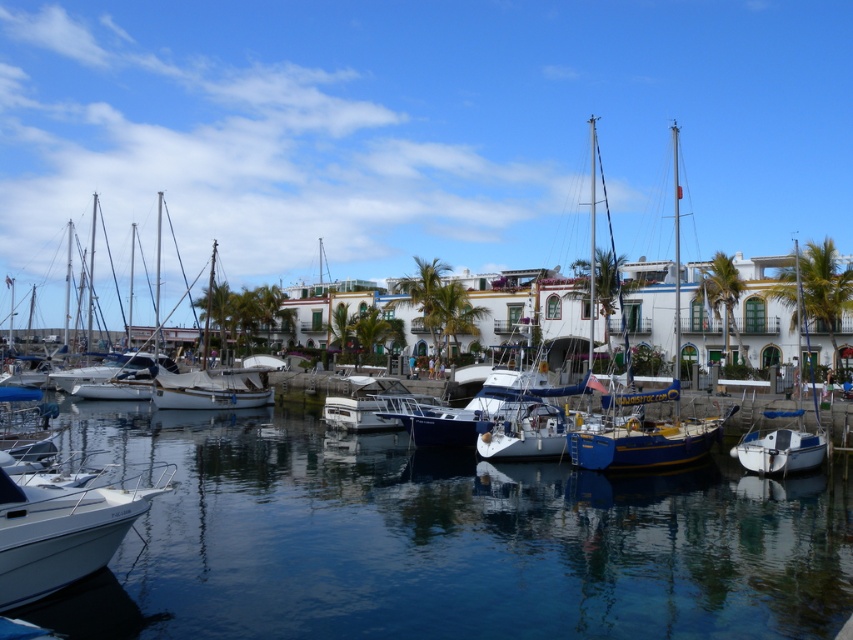
Which of these two, blue glossy sailboat at center or white matte sailboat at center, stands taller?

blue glossy sailboat at center

Can you confirm if blue glossy sailboat at center is bigger than white matte sailboat at center?

Indeed, blue glossy sailboat at center has a larger size compared to white matte sailboat at center.

Is point (635, 396) in front of point (234, 371)?

That is True.

This screenshot has width=853, height=640. I want to click on blue glossy sailboat at center, so click(647, 403).

Is blue reflective water at center thinner than blue glossy sailboat at center?

Indeed, blue reflective water at center has a lesser width compared to blue glossy sailboat at center.

Identify the location of blue reflective water at center. Image resolution: width=853 pixels, height=640 pixels. (442, 540).

Find the location of a particular element. The image size is (853, 640). blue reflective water at center is located at coordinates (442, 540).

Is white matte boat at right smaller than white glossy sailboat at center?

Yes.

Between white matte boat at right and white glossy sailboat at center, which one is positioned higher?

Positioned higher is white glossy sailboat at center.

Locate an element on the screen. This screenshot has width=853, height=640. white matte boat at right is located at coordinates (799, 356).